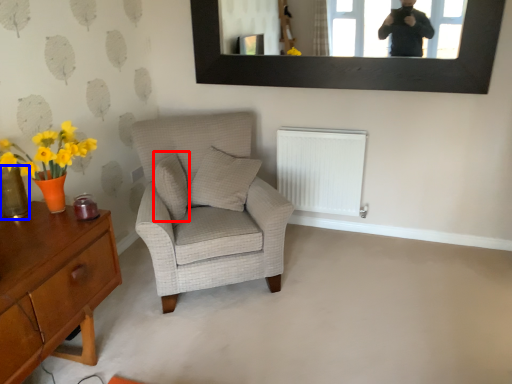
Question: Which object is closer to the camera taking this photo, pillow (highlighted by a red box) or glass vase (highlighted by a blue box)?

Choices:
 (A) pillow
 (B) glass vase

Answer: (B)